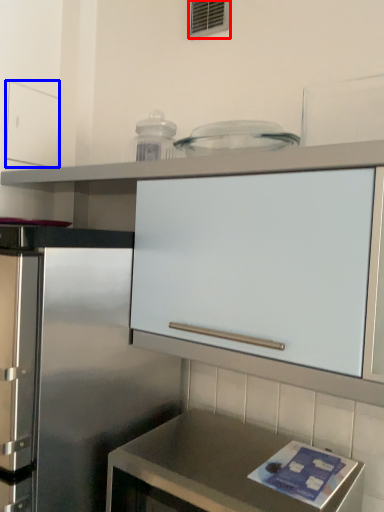
Question: Which point is further to the camera, window (highlighted by a red box) or drawer (highlighted by a blue box)?

Choices:
 (A) window
 (B) drawer

Answer: (B)